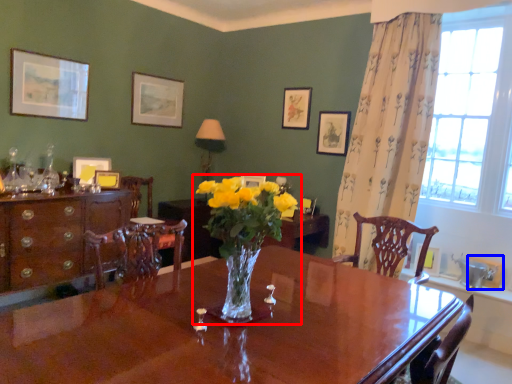
Question: Among these objects, which one is farthest to the camera, houseplant (highlighted by a red box) or picture frame (highlighted by a blue box)?

Choices:
 (A) houseplant
 (B) picture frame

Answer: (B)